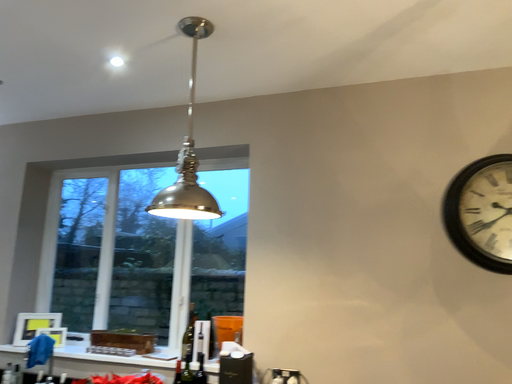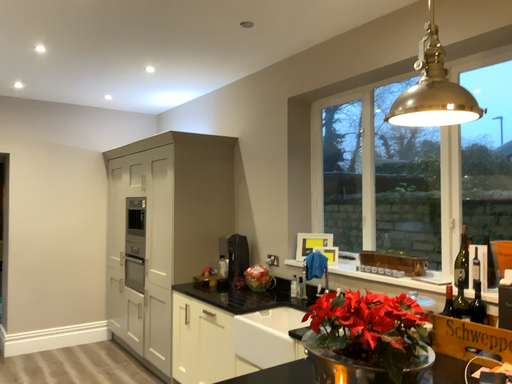
Question: How did the camera likely rotate when shooting the video?

Choices:
 (A) rotated upward
 (B) rotated downward

Answer: (B)